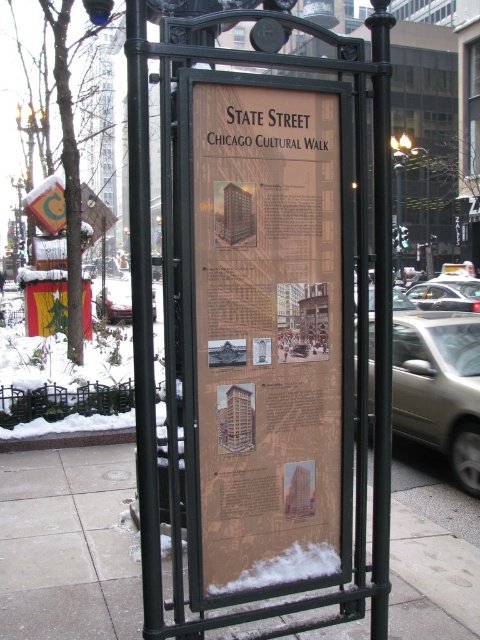
Question: Which is nearer to the black metal pole at center?

Choices:
 (A) wooden signboard at center
 (B) yellow rubber taxi at center right
 (C) smooth concrete pavement at center
 (D) polished brass lamp post at upper right

Answer: (A)

Question: Is smooth concrete pavement at center to the left of metallic pole at upper center from the viewer's perspective?

Choices:
 (A) yes
 (B) no

Answer: (A)

Question: From the image, what is the correct spatial relationship of matte silver sedan at right in relation to black metal pole at center?

Choices:
 (A) right
 (B) left

Answer: (A)

Question: Is matte brown sign at center thinner than matte silver sedan at right?

Choices:
 (A) yes
 (B) no

Answer: (B)

Question: Which object is positioned closest to the metallic silver car at center?

Choices:
 (A) matte brown sign at center
 (B) wooden signboard at center
 (C) yellow rubber taxi at center right

Answer: (A)

Question: Which object appears farthest from the camera in this image?

Choices:
 (A) matte silver sedan at right
 (B) matte brown sign at center
 (C) yellow rubber taxi at center right
 (D) metallic silver car at center

Answer: (C)